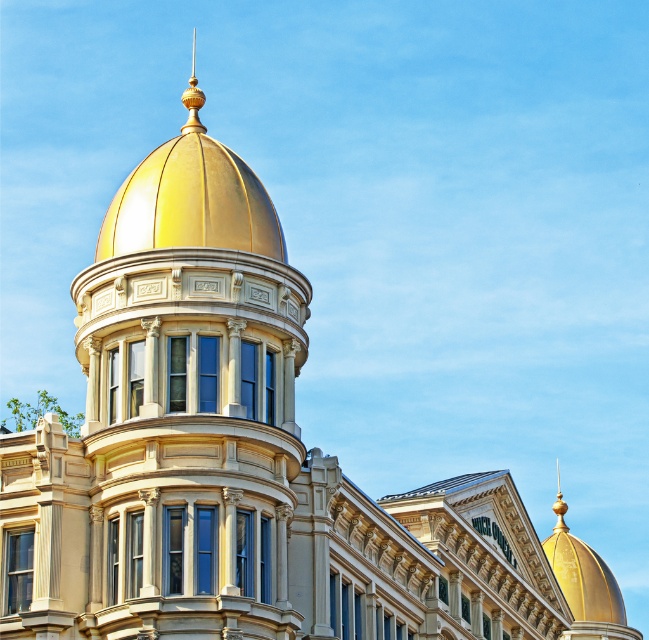
Can you confirm if gold polished dome at center is positioned to the right of gold polished spire at upper center?

Correct, you'll find gold polished dome at center to the right of gold polished spire at upper center.

Is point (247, 192) more distant than point (193, 33)?

No.

Where is `gold polished dome at center`? The width and height of the screenshot is (649, 640). gold polished dome at center is located at coordinates (184, 406).